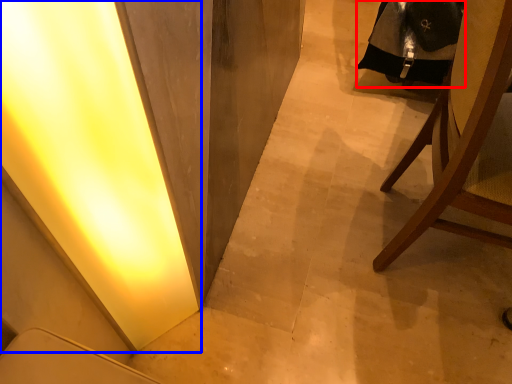
Question: Which point is closer to the camera, robe (highlighted by a red box) or light (highlighted by a blue box)?

Choices:
 (A) robe
 (B) light

Answer: (B)